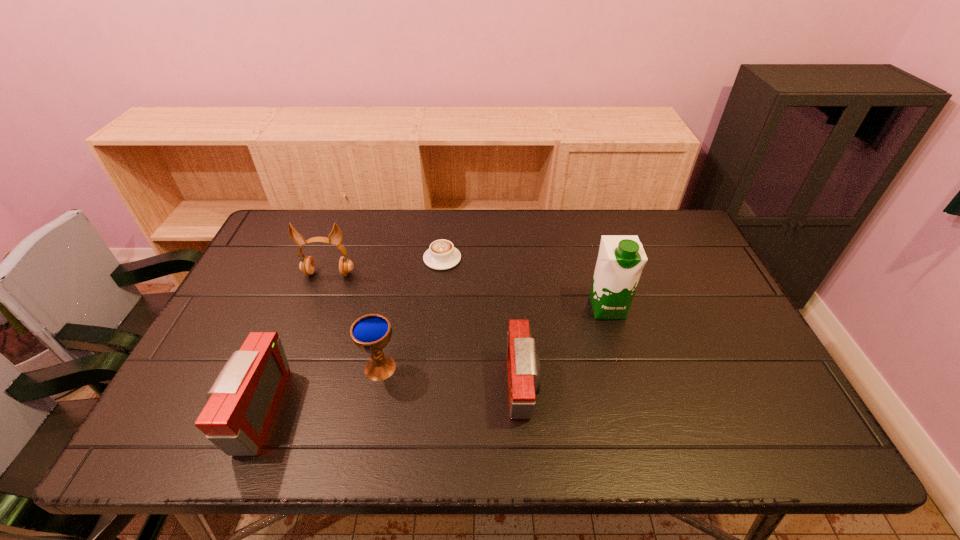
Identify the location of free space for a new camera on the right. (767, 366).